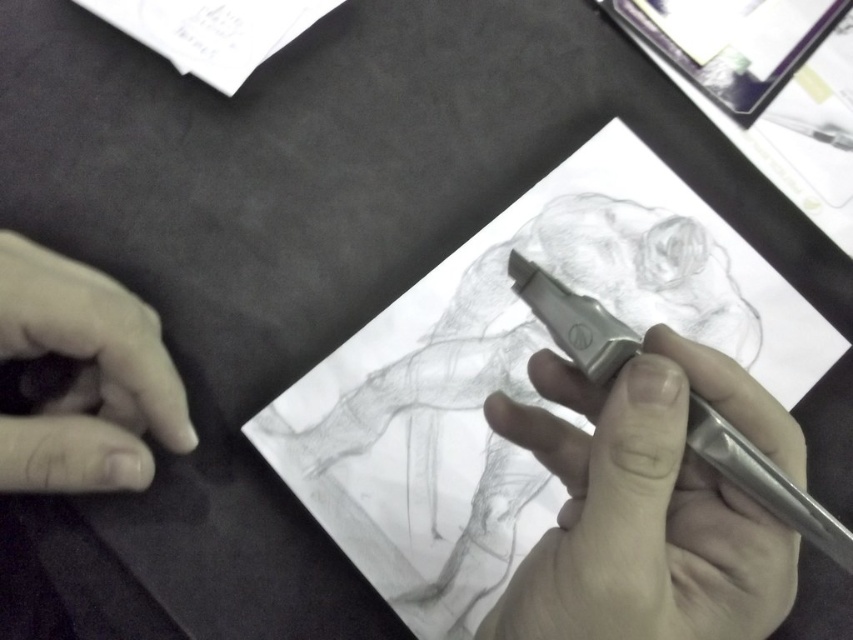
Is graphite paper at center below smooth skin at lower left?

Correct, graphite paper at center is located below smooth skin at lower left.

Does graphite paper at center have a greater height compared to smooth skin at lower left?

Indeed, graphite paper at center has a greater height compared to smooth skin at lower left.

Which is in front, point (531, 461) or point (6, 278)?

Positioned in front is point (6, 278).

I want to click on graphite paper at center, so click(514, 376).

Who is shorter, graphite paper at center or metallic pen at lower right?

metallic pen at lower right is shorter.

Does point (502, 477) come in front of point (648, 358)?

No, it is behind (648, 358).

Identify the location of graphite paper at center. The image size is (853, 640). (514, 376).

Between metallic pen at lower right and smooth skin at lower left, which one has less height?

smooth skin at lower left is shorter.

Does metallic pen at lower right appear on the right side of smooth skin at lower left?

Indeed, metallic pen at lower right is positioned on the right side of smooth skin at lower left.

Image resolution: width=853 pixels, height=640 pixels. I want to click on metallic pen at lower right, so click(x=648, y=506).